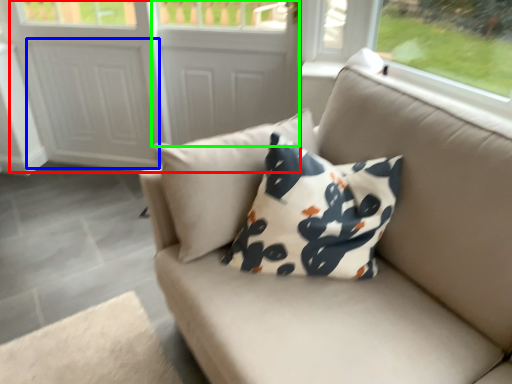
Question: Estimate the real-world distances between objects in this image. Which object is closer to screen door (highlighted by a red box), screen door (highlighted by a blue box) or screen door (highlighted by a green box)?

Choices:
 (A) screen door
 (B) screen door

Answer: (A)